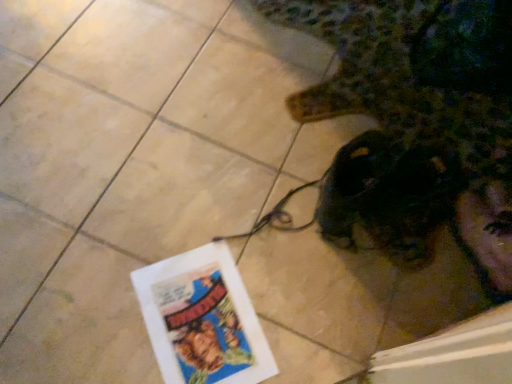
Locate an element on the screen. The height and width of the screenshot is (384, 512). vacant space situated on the left part of white paper flyer at lower left is located at coordinates (97, 292).